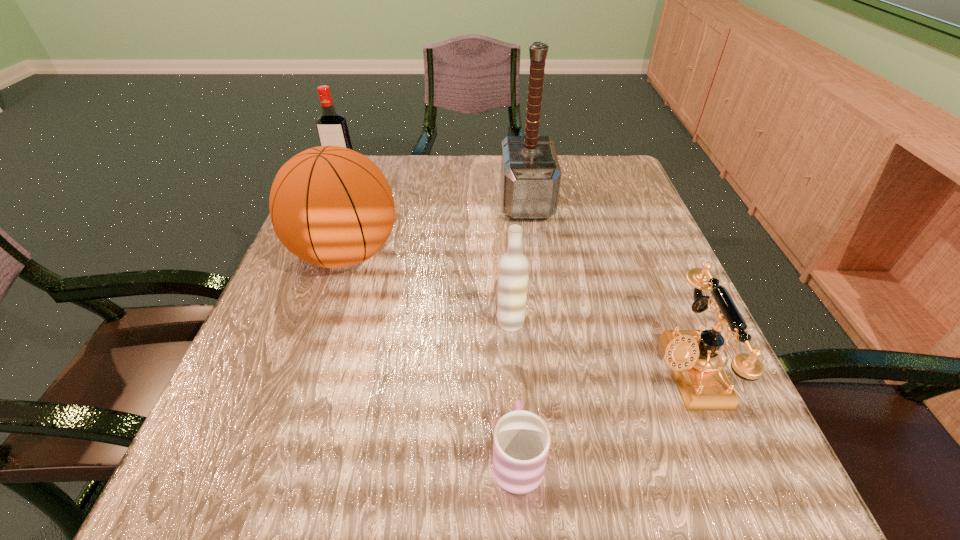
Identify the location of blank space located on the left of the nearer vodka. (342, 322).

Where is `vacant space located 0.070m on the dial of the telephone`? The width and height of the screenshot is (960, 540). vacant space located 0.070m on the dial of the telephone is located at coordinates (615, 369).

Identify the location of free space located on the dial of the telephone. The height and width of the screenshot is (540, 960). (458, 369).

I want to click on vacant position located on the dial of the telephone, so pyautogui.click(x=523, y=369).

At what (x,y) coordinates should I click in order to perform the action: click on free spot located with the handle on the side of the cup. Please return your answer as a coordinate pair (x, y). This screenshot has height=540, width=960. Looking at the image, I should click on (507, 290).

Find the location of a particular element. free space located with the handle on the side of the cup is located at coordinates (512, 368).

Where is `vacant position located with the handle on the side of the cup`? This screenshot has height=540, width=960. vacant position located with the handle on the side of the cup is located at coordinates (507, 298).

Locate an element on the screen. This screenshot has width=960, height=540. hammer present at the far edge is located at coordinates (530, 177).

Where is `vodka located at the far edge`? The image size is (960, 540). vodka located at the far edge is located at coordinates pyautogui.click(x=332, y=128).

In order to click on object located in the near edge section of the desktop in this screenshot , I will do `click(521, 441)`.